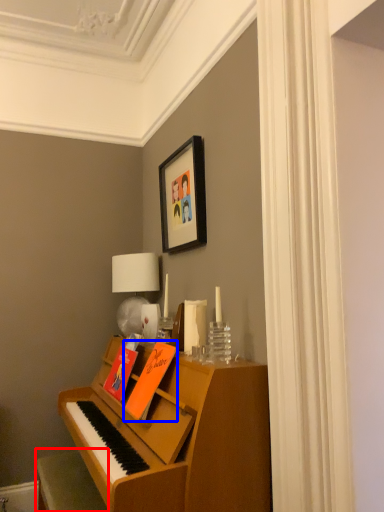
Question: Which of the following is the closest to the observer, furniture (highlighted by a red box) or book (highlighted by a blue box)?

Choices:
 (A) furniture
 (B) book

Answer: (A)